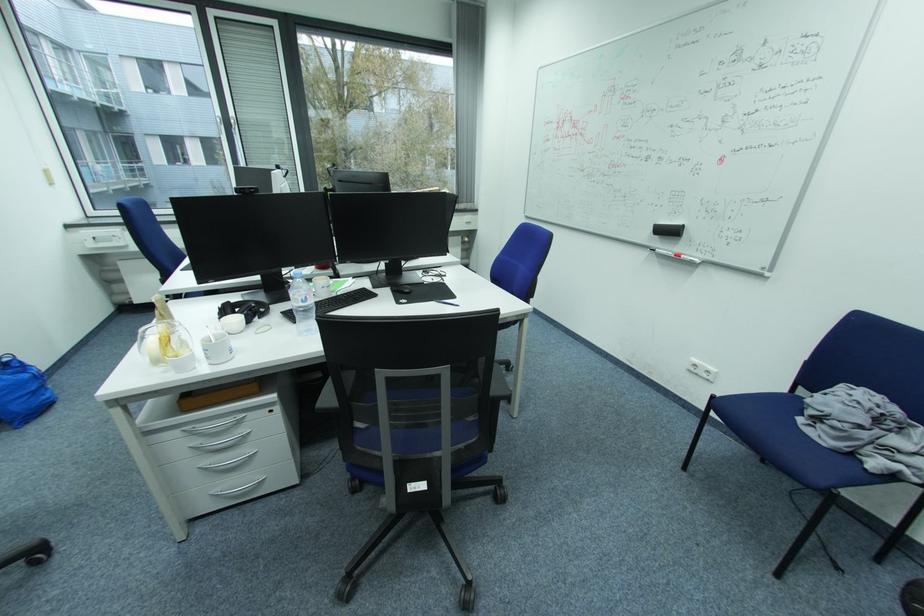
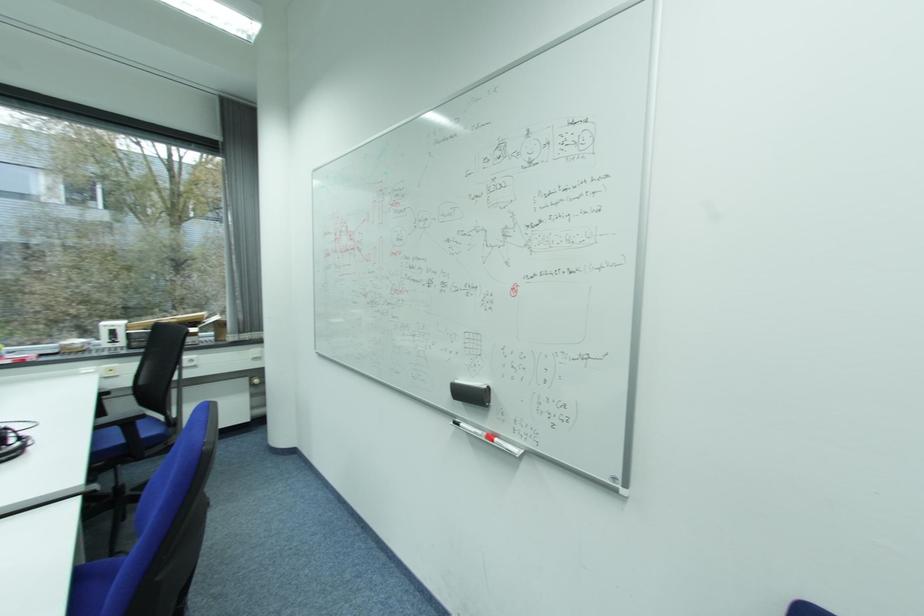
Locate, in the second image, the point that corresponds to point 652,236 in the first image.

(453, 398)